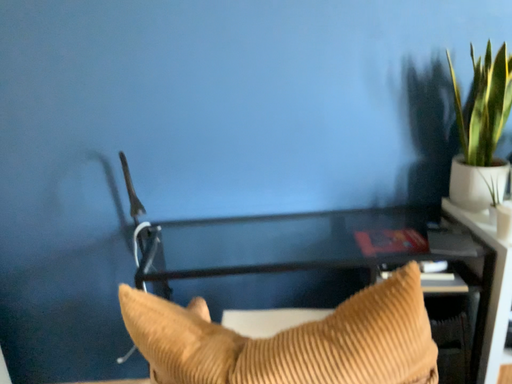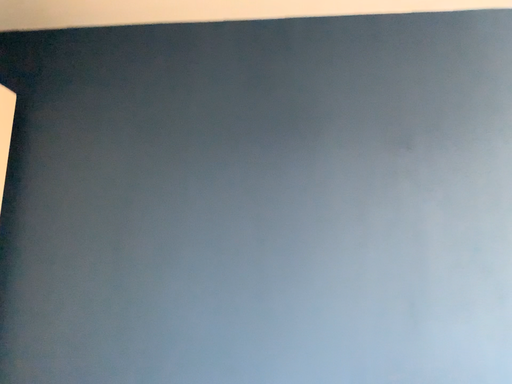
Question: Which way did the camera rotate in the video?

Choices:
 (A) rotated downward
 (B) rotated upward

Answer: (B)